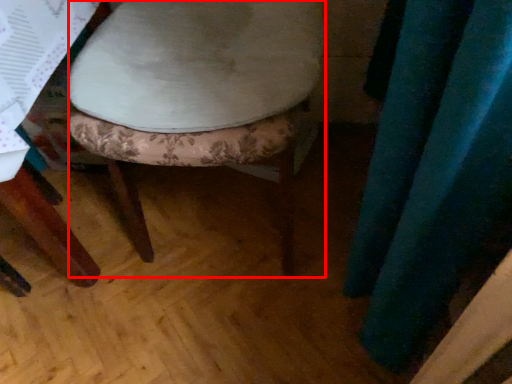
Question: From the image's perspective, what is the correct spatial relationship of stool (annotated by the red box) in relation to curtain?

Choices:
 (A) below
 (B) above

Answer: (B)